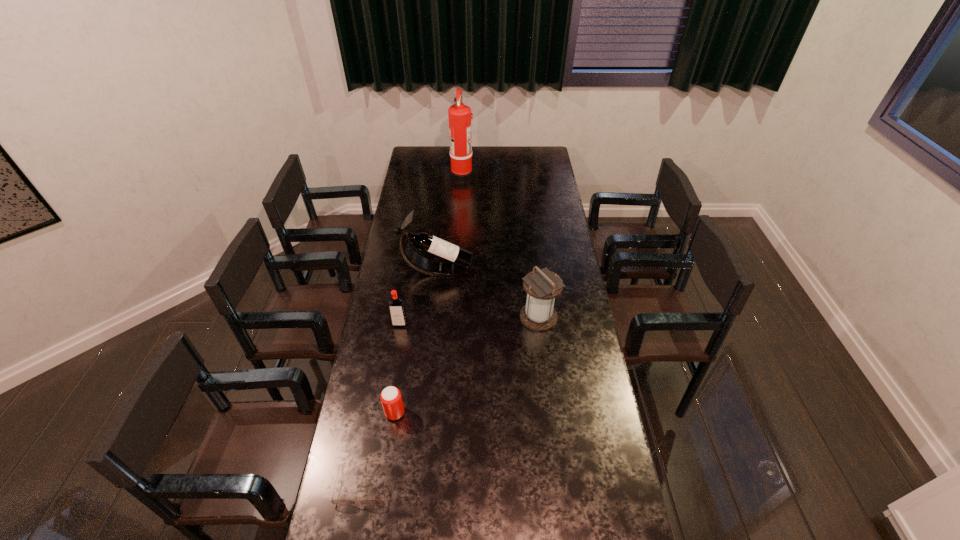
You are a GUI agent. You are given a task and a screenshot of the screen. Output one action in this format:
    pyautogui.click(x=<x>, y=<y>)
    Task: Click on the beer can at the left edge
    
    Given the screenshot: What is the action you would take?
    pos(391,399)

The height and width of the screenshot is (540, 960). I want to click on sunglasses present at the left edge, so click(339, 501).

Identify the location of object that is positioned at the right edge. This screenshot has width=960, height=540. (542, 286).

Locate an element on the screen. Image resolution: width=960 pixels, height=540 pixels. free space at the far edge is located at coordinates (441, 153).

Identify the location of free space at the left edge. (407, 207).

In the image, there is a desktop. Identify the location of vacant space at the right edge. The image size is (960, 540). (632, 526).

This screenshot has height=540, width=960. In the image, there is a desktop. Find the location of `free space at the far left corner`. free space at the far left corner is located at coordinates (416, 155).

The image size is (960, 540). I want to click on free space at the far right corner of the desktop, so click(x=542, y=158).

At what (x,y) coordinates should I click in order to perform the action: click on vacant space that's between the fourth tallest object and the second nearest object. Please return your answer as a coordinate pair (x, y). Looking at the image, I should click on (397, 368).

The width and height of the screenshot is (960, 540). What are the coordinates of `vacant space that's between the third tallest object and the farthest object` in the screenshot? It's located at (500, 246).